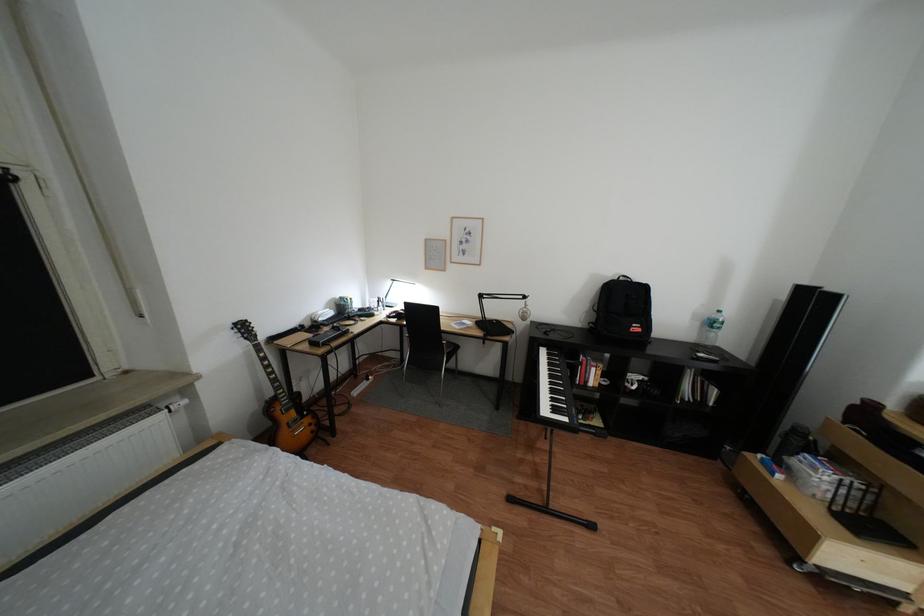
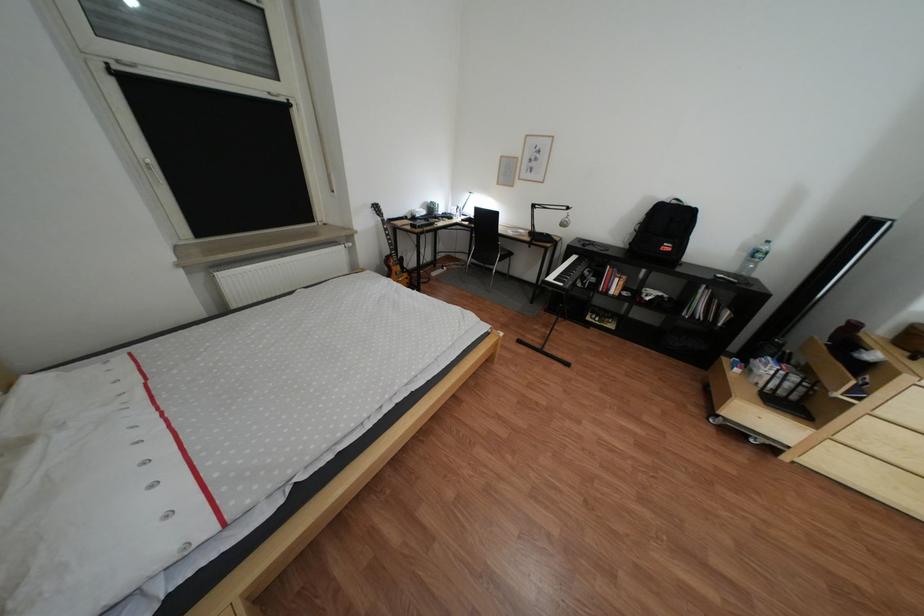
Where in the second image is the point corresponding to point 651,329 from the first image?

(683, 248)